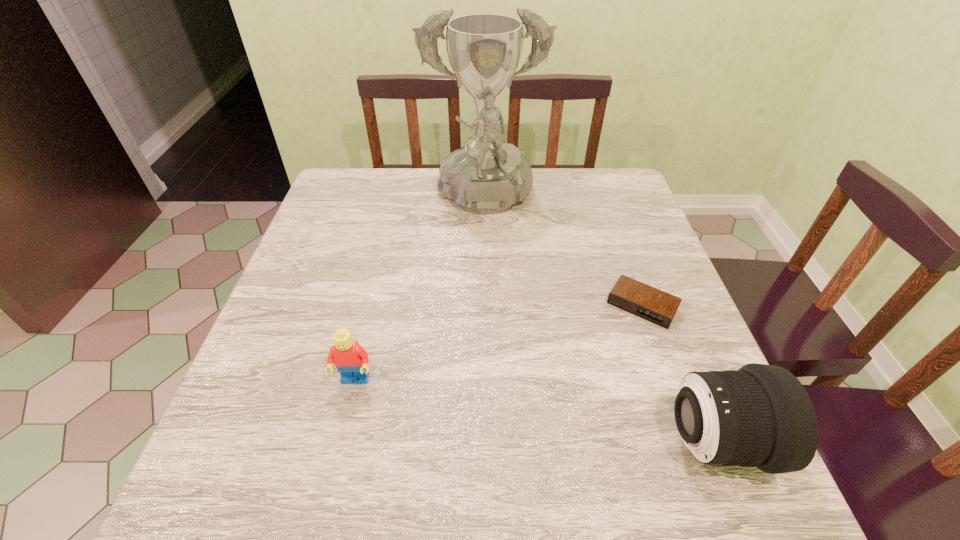
At what (x,y) coordinates should I click in order to perform the action: click on vacant space at the near edge of the desktop. Please return your answer as a coordinate pair (x, y). This screenshot has height=540, width=960. Looking at the image, I should click on (638, 437).

Identify the location of vacant space at the left edge. The width and height of the screenshot is (960, 540). (279, 312).

I want to click on free region at the right edge of the desktop, so click(x=672, y=378).

Where is `vacant space at the far left corner of the desktop`? The width and height of the screenshot is (960, 540). vacant space at the far left corner of the desktop is located at coordinates (351, 195).

At what (x,y) coordinates should I click in order to perform the action: click on free spot at the far right corner of the desktop. Please return your answer as a coordinate pair (x, y). This screenshot has width=960, height=540. Looking at the image, I should click on (614, 175).

You are a GUI agent. You are given a task and a screenshot of the screen. Output one action in this format:
    pyautogui.click(x=<x>, y=<y>)
    Task: Click on the vacant space in between the telephoto lens and the second nearest object
    
    Given the screenshot: What is the action you would take?
    pyautogui.click(x=535, y=411)

Locate an element on the screen. The image size is (960, 540). vacant region between the alarm clock and the nearest object is located at coordinates (678, 374).

Where is `blank region between the leftmost object and the telephoto lens`? The height and width of the screenshot is (540, 960). blank region between the leftmost object and the telephoto lens is located at coordinates (535, 411).

You are a GUI agent. You are given a task and a screenshot of the screen. Output one action in this format:
    pyautogui.click(x=<x>, y=<y>)
    Task: Click on the free space between the second object from left to right and the alarm clock
    
    Given the screenshot: What is the action you would take?
    pyautogui.click(x=563, y=254)

This screenshot has width=960, height=540. I want to click on unoccupied position between the second tallest object and the award, so [599, 322].